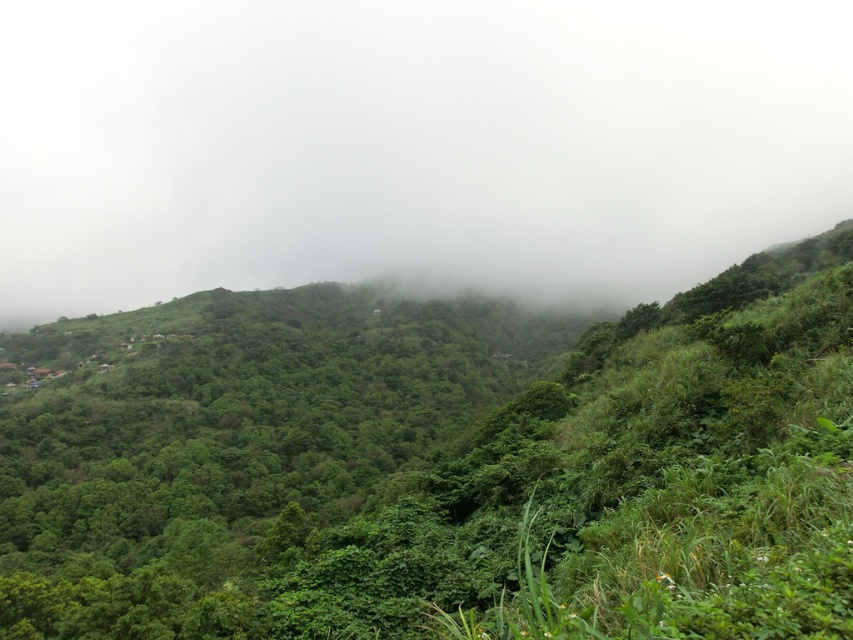
Question: Which point appears farthest from the camera in this image?

Choices:
 (A) (294, 156)
 (B) (36, 416)

Answer: (A)

Question: In this image, where is green leafy vegetation at center located relative to white foggy cloud at upper center?

Choices:
 (A) left
 (B) right

Answer: (A)

Question: Can you confirm if green leafy vegetation at center is positioned above white foggy cloud at upper center?

Choices:
 (A) yes
 (B) no

Answer: (B)

Question: Which of the following is the closest to the observer?

Choices:
 (A) white foggy cloud at upper center
 (B) green leafy vegetation at center

Answer: (B)

Question: Observing the image, what is the correct spatial positioning of green leafy vegetation at center in reference to white foggy cloud at upper center?

Choices:
 (A) left
 (B) right

Answer: (A)